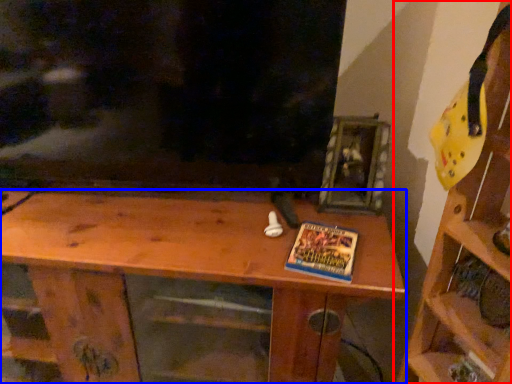
Question: Which object is closer to the camera taking this photo, shelf (highlighted by a red box) or shelf (highlighted by a blue box)?

Choices:
 (A) shelf
 (B) shelf

Answer: (A)